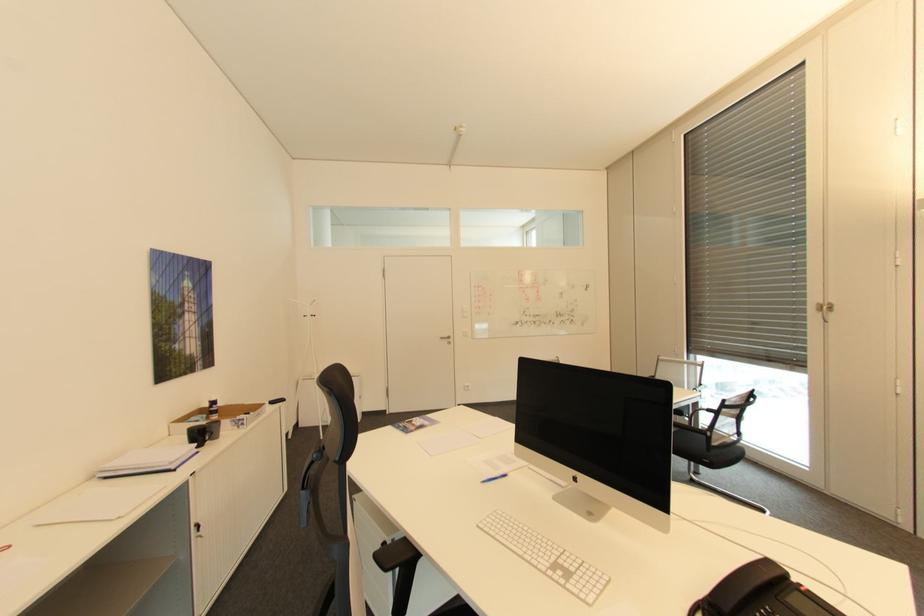
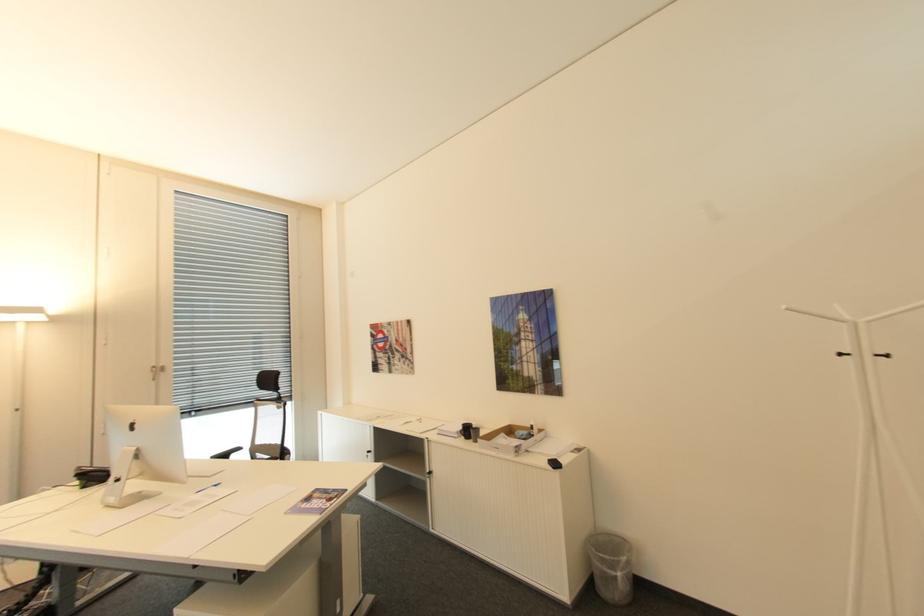
Locate, in the second image, the point that corresponds to pixel 320 315 in the first image.

(894, 355)